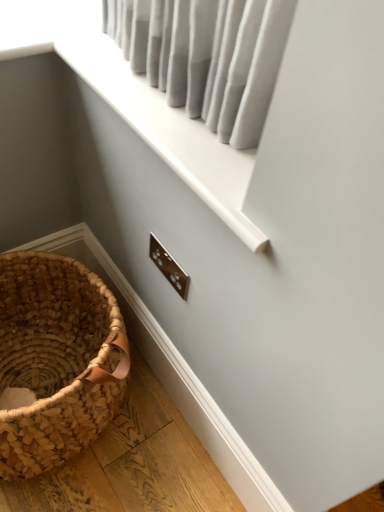
Question: Is brown woven picnic basket at lower left wider or thinner than white plastic window frame at upper center?

Choices:
 (A) thin
 (B) wide

Answer: (B)

Question: Is brown woven picnic basket at lower left taller or shorter than white plastic window frame at upper center?

Choices:
 (A) short
 (B) tall

Answer: (B)

Question: Would you say brown woven picnic basket at lower left is to the left or to the right of white plastic window frame at upper center in the picture?

Choices:
 (A) left
 (B) right

Answer: (A)

Question: In terms of size, does white plastic window frame at upper center appear bigger or smaller than brown woven picnic basket at lower left?

Choices:
 (A) small
 (B) big

Answer: (A)

Question: From a real-world perspective, is white plastic window frame at upper center above or below brown woven picnic basket at lower left?

Choices:
 (A) above
 (B) below

Answer: (A)

Question: Is point (193, 178) closer or farther from the camera than point (77, 280)?

Choices:
 (A) closer
 (B) farther

Answer: (A)

Question: Is white plastic window frame at upper center inside the boundaries of brown woven picnic basket at lower left, or outside?

Choices:
 (A) outside
 (B) inside

Answer: (A)